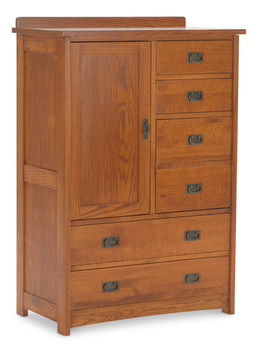
You are a GUI agent. You are given a task and a screenshot of the screen. Output one action in this format:
    pyautogui.click(x=<x>, y=<y>)
    Task: Click on the middle compartment
    The height and width of the screenshot is (360, 258).
    Given the screenshot: What is the action you would take?
    pyautogui.click(x=186, y=191), pyautogui.click(x=176, y=154)